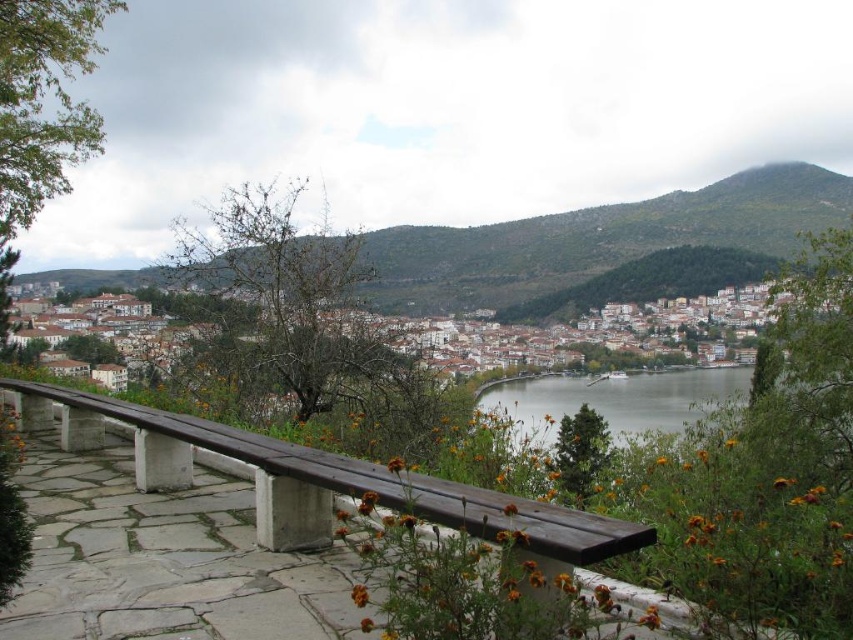
Question: Based on their relative distances, which object is nearer to the green grassy hillside at upper center?

Choices:
 (A) clear water at center
 (B) brown wooden bench at center

Answer: (A)

Question: Where is brown wooden bench at center located in relation to clear water at center in the image?

Choices:
 (A) above
 (B) below

Answer: (A)

Question: Which is nearer to the green grassy hillside at upper center?

Choices:
 (A) clear water at center
 (B) brown wooden bench at center

Answer: (A)

Question: Does green grassy hillside at upper center have a lesser width compared to brown wooden bench at center?

Choices:
 (A) no
 (B) yes

Answer: (A)

Question: Observing the image, what is the correct spatial positioning of green grassy hillside at upper center in reference to clear water at center?

Choices:
 (A) below
 (B) above

Answer: (B)

Question: Among these points, which one is nearest to the camera?

Choices:
 (A) (450, 522)
 (B) (805, 168)
 (C) (784, 440)

Answer: (A)